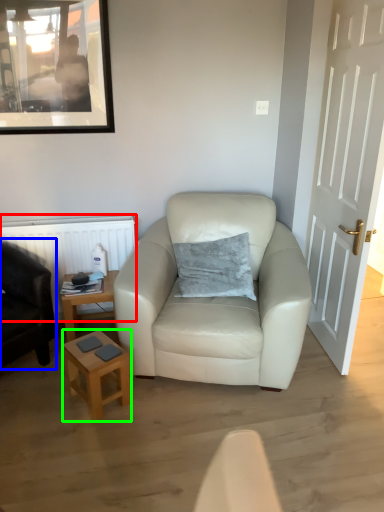
Question: Considering the real-world distances, which object is closest to radiator (highlighted by a red box)? chair (highlighted by a blue box) or stool (highlighted by a green box).

Choices:
 (A) chair
 (B) stool

Answer: (A)